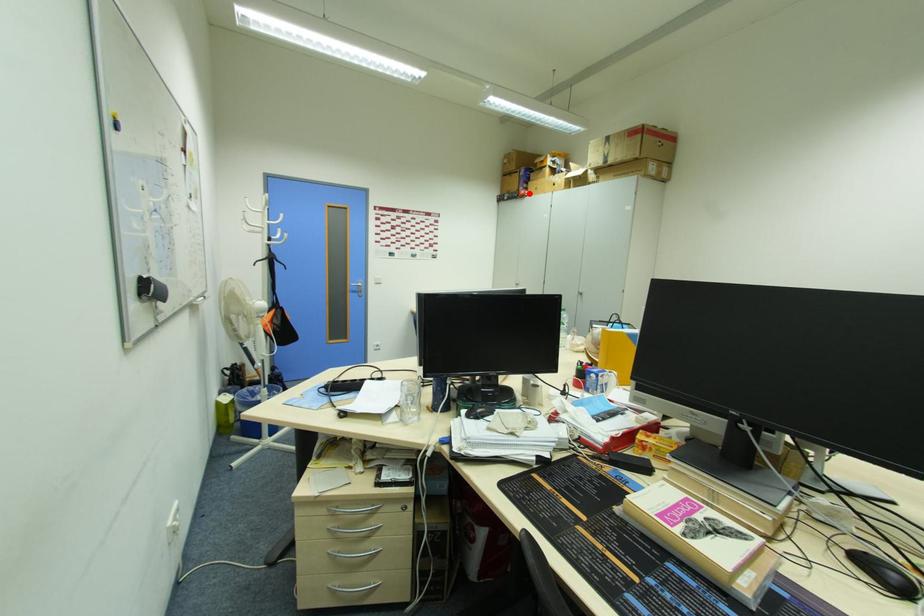
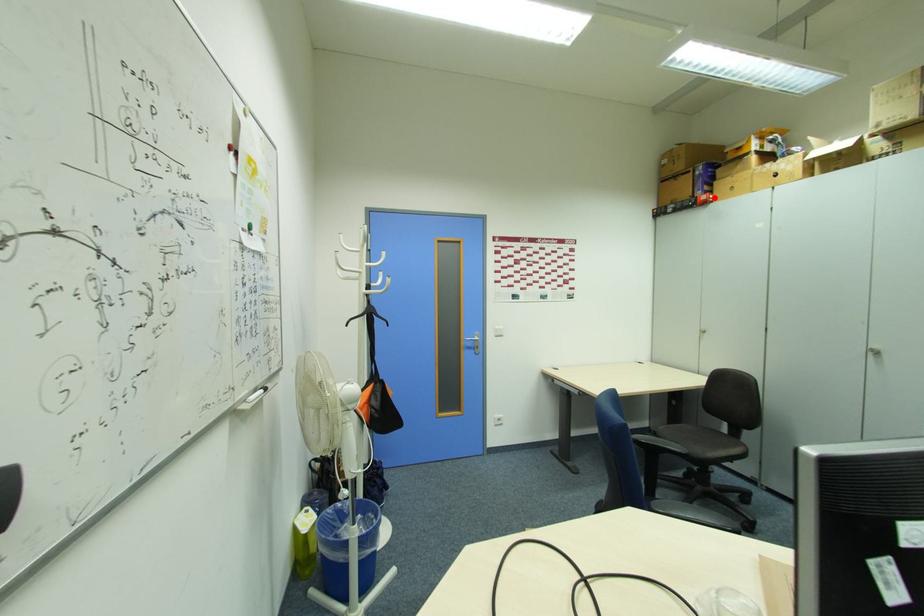
I am providing you with two images of the same scene from different viewpoints. A red point is marked on the first image and another point is marked on the second image. Does the point marked in image1 correspond to the same location as the one in image2?

Yes